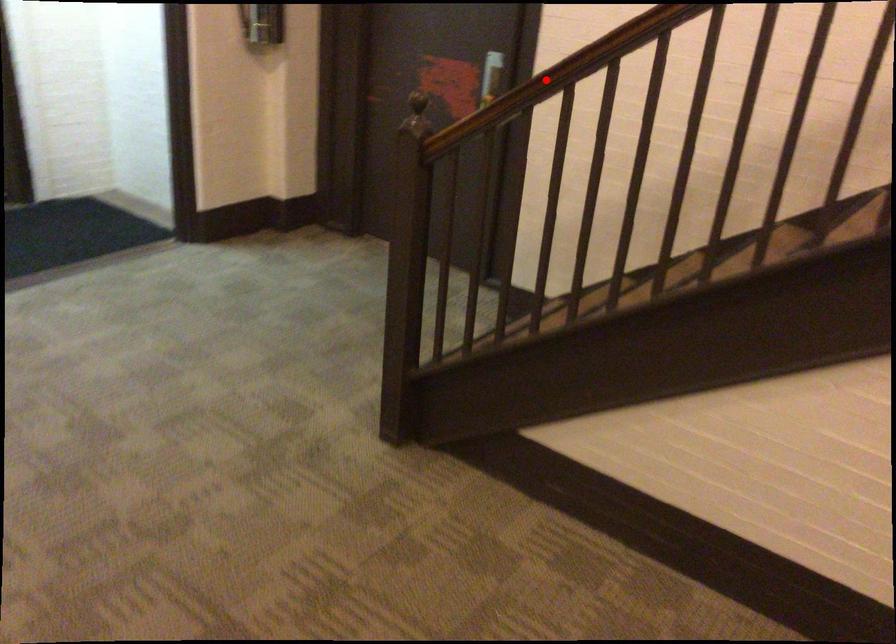
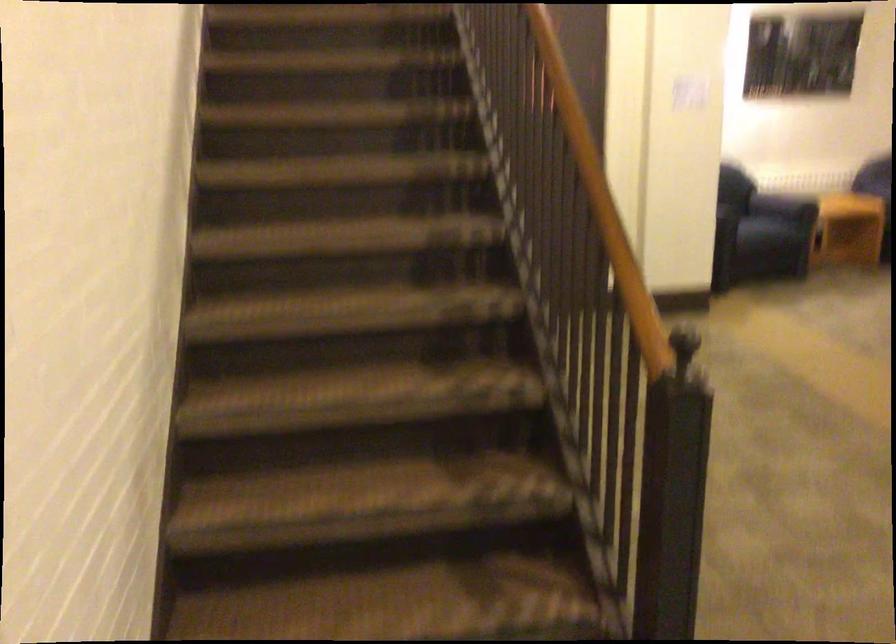
Question: I am providing you with two images of the same scene from different viewpoints. A red point is marked on the first image. At the location where the point appears in image 1, is it still visible in image 2?

Choices:
 (A) Yes
 (B) No

Answer: (B)